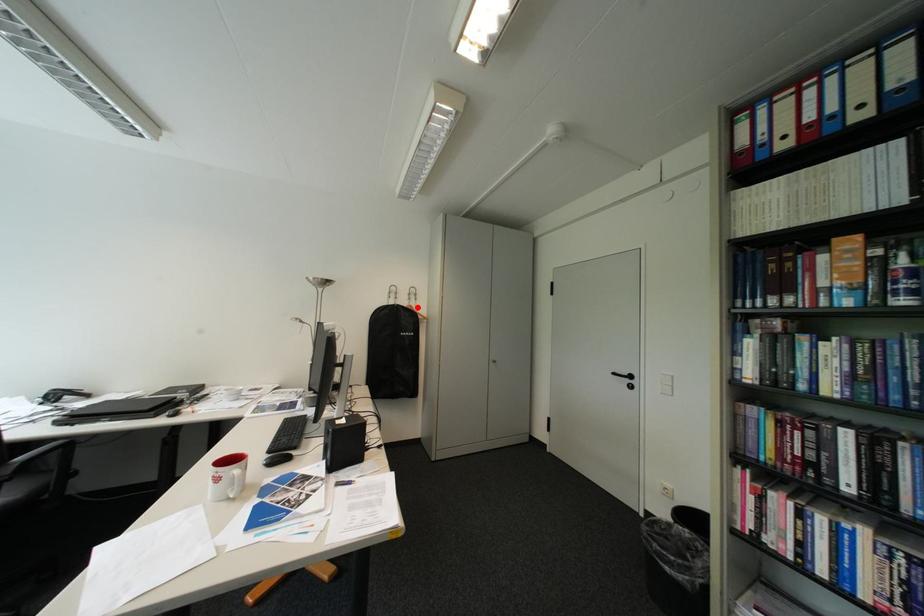
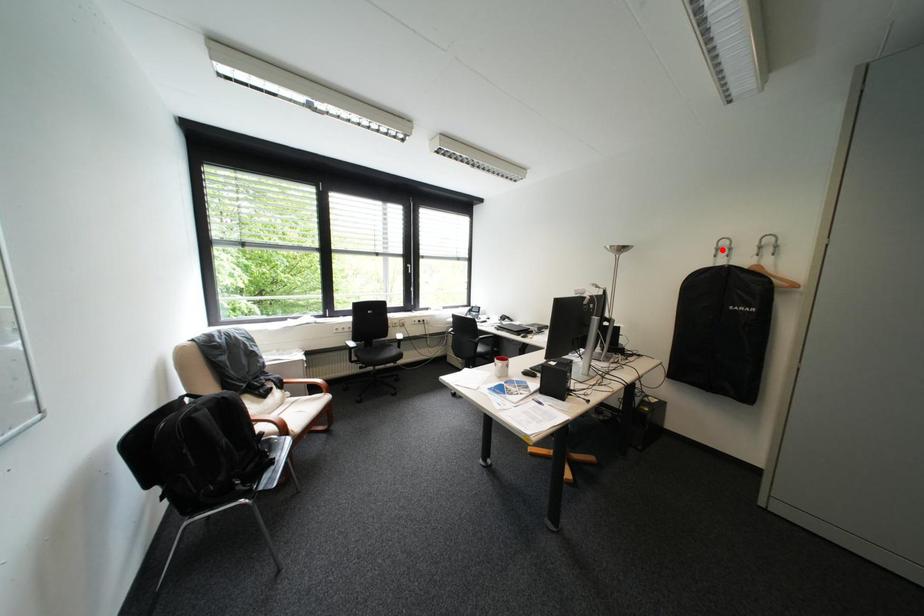
I am providing you with two images of the same scene from different viewpoints. A red point is marked on the first image and another point is marked on the second image. Are the points marked in image1 and image2 representing the same 3D position?

No